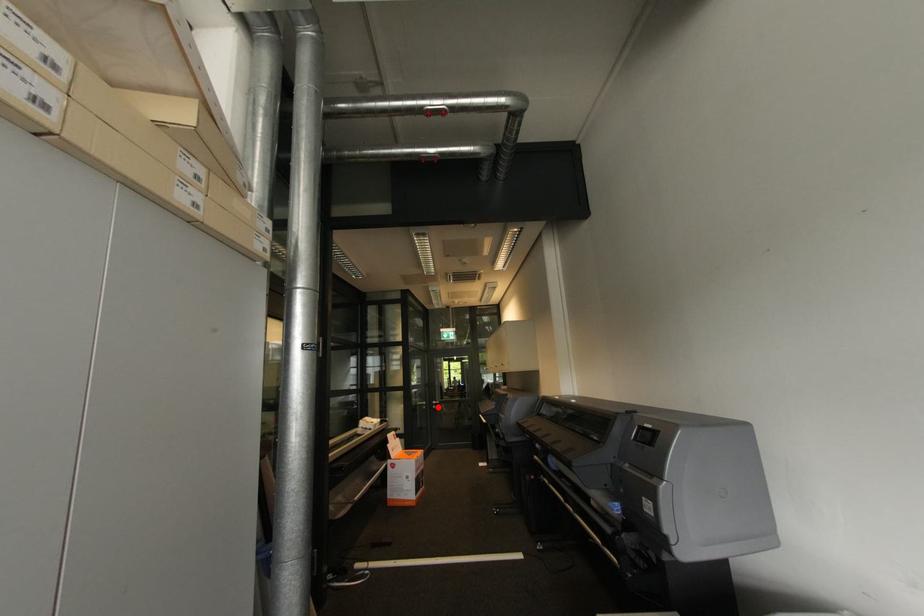
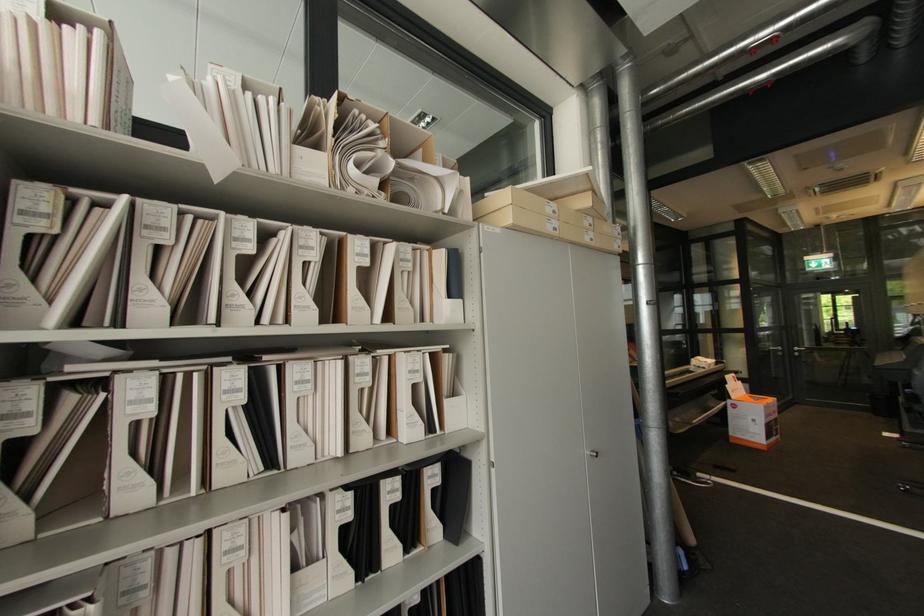
Question: I am providing you with two images of the same scene from different viewpoints. Given a red point in image1, look at the same physical point in image2. Is it:

Choices:
 (A) Closer to the viewpoint
 (B) Farther from the viewpoint

Answer: (A)